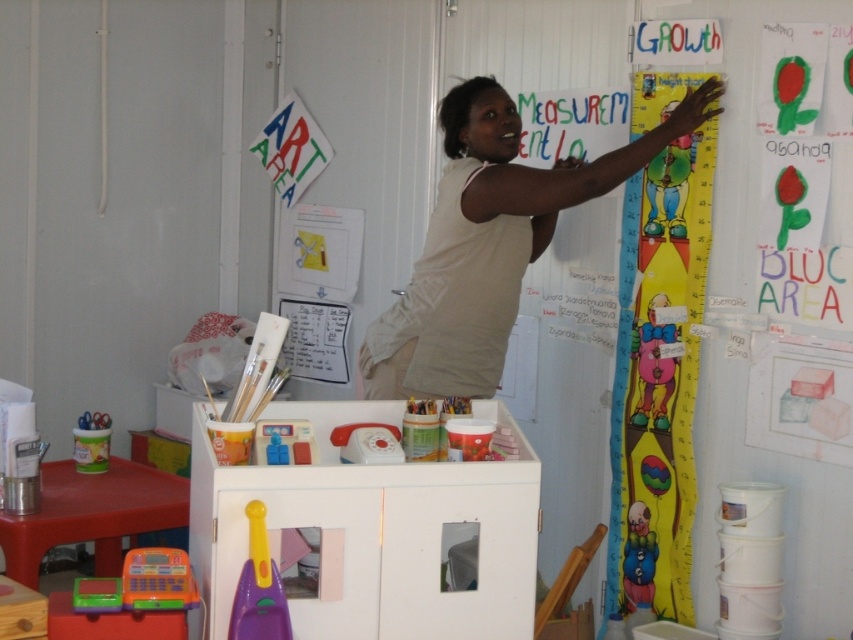
You are a student in the classroom and need to reach the whiteboard. You see the matte plastic clown at lower right and the matte plastic container at left. Which object is closer to you as you face the whiteboard?

The matte plastic clown at lower right is closer to you because it is in front of the matte plastic container at left, which is behind it.

You are a teacher in the classroom and need to place a new poster between the matte plastic clown at lower right and the matte plastic container at left. Which object should the poster be closer to if it needs to be placed at the same height as the taller object?

The poster should be placed closer to the matte plastic clown at lower right because it is taller than the matte plastic container at left.

You are a child in the classroom and you want to measure your height using the cartoon paper height chart at upper right. Where exactly should you stand to use it?

The cartoon paper height chart at upper right is located at coordinates point (657, 378), so you should stand directly in front of that point to measure your height.